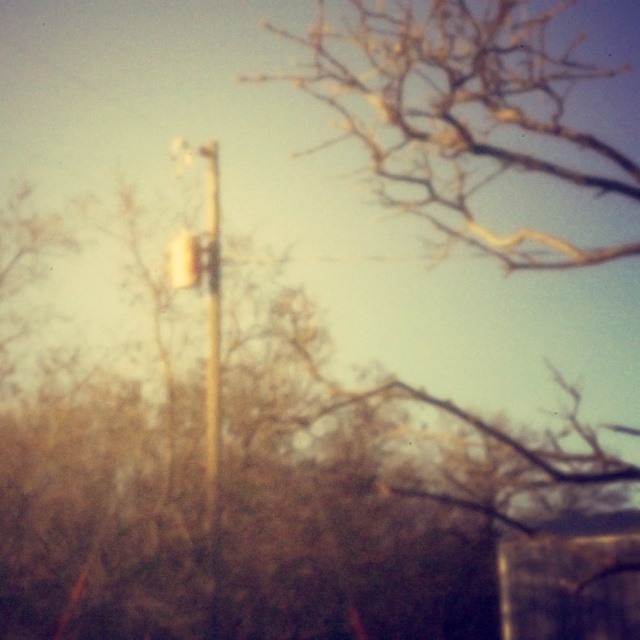
Can you confirm if wooden pole at center is bigger than metallic silver traffic light at center?

Yes, wooden pole at center is bigger than metallic silver traffic light at center.

Does wooden pole at center appear on the right side of metallic silver traffic light at center?

Yes, wooden pole at center is to the right of metallic silver traffic light at center.

Image resolution: width=640 pixels, height=640 pixels. I want to click on wooden pole at center, so click(x=208, y=339).